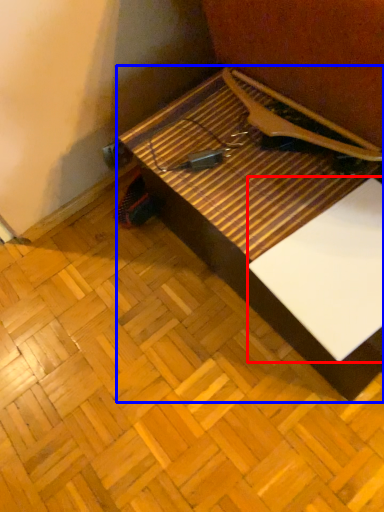
Question: Among these objects, which one is nearest to the camera, wide (highlighted by a red box) or table (highlighted by a blue box)?

Choices:
 (A) wide
 (B) table

Answer: (B)